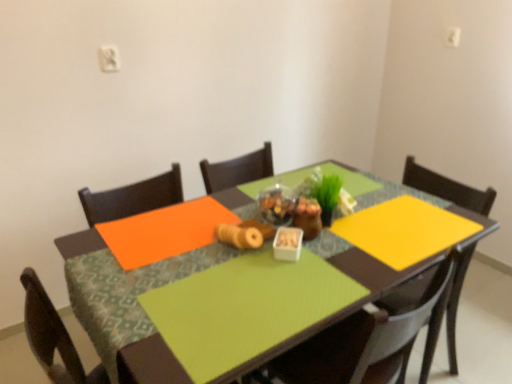
Question: Can we say matte brown chair at center lies outside green matte plant at center?

Choices:
 (A) no
 (B) yes

Answer: (B)

Question: Can you confirm if matte brown chair at center is thinner than green matte plant at center?

Choices:
 (A) no
 (B) yes

Answer: (A)

Question: Does matte brown chair at center come behind green matte plant at center?

Choices:
 (A) no
 (B) yes

Answer: (A)

Question: From the image's perspective, is matte brown chair at center over green matte plant at center?

Choices:
 (A) no
 (B) yes

Answer: (A)

Question: Is matte brown chair at center far from green matte plant at center?

Choices:
 (A) no
 (B) yes

Answer: (A)

Question: Considering the relative positions of matte brown chair at center and white matte container at center in the image provided, is matte brown chair at center to the left or to the right of white matte container at center?

Choices:
 (A) right
 (B) left

Answer: (A)

Question: Considering the positions of matte brown chair at center and white matte container at center in the image, is matte brown chair at center wider or thinner than white matte container at center?

Choices:
 (A) wide
 (B) thin

Answer: (A)

Question: From their relative heights in the image, would you say matte brown chair at center is taller or shorter than white matte container at center?

Choices:
 (A) tall
 (B) short

Answer: (A)

Question: Would you say matte brown chair at center is inside or outside white matte container at center?

Choices:
 (A) inside
 (B) outside

Answer: (B)

Question: Is white matte container at center to the left or to the right of matte brown chair at center in the image?

Choices:
 (A) left
 (B) right

Answer: (A)

Question: Considering the positions of white matte container at center and matte brown chair at center in the image, is white matte container at center taller or shorter than matte brown chair at center?

Choices:
 (A) tall
 (B) short

Answer: (B)

Question: Relative to matte brown chair at center, is white matte container at center in front or behind?

Choices:
 (A) front
 (B) behind

Answer: (B)

Question: From a real-world perspective, is white matte container at center positioned above or below matte brown chair at center?

Choices:
 (A) below
 (B) above

Answer: (B)

Question: From a real-world perspective, is matte brown chair at center physically located above or below green fabric table at center?

Choices:
 (A) below
 (B) above

Answer: (B)

Question: In terms of size, does matte brown chair at center appear bigger or smaller than green fabric table at center?

Choices:
 (A) small
 (B) big

Answer: (A)